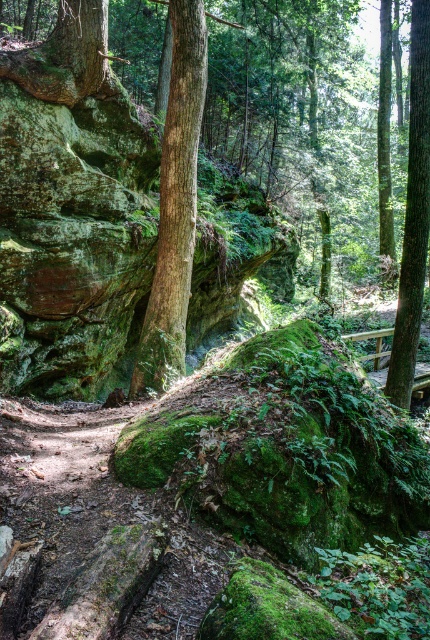
Question: Which object appears farthest from the camera in this image?

Choices:
 (A) green mossy rock at center
 (B) green rough bark tree at right
 (C) green rough bark tree at center

Answer: (B)

Question: Considering the relative positions of green rough bark tree at center and green rough bark tree at right in the image provided, where is green rough bark tree at center located with respect to green rough bark tree at right?

Choices:
 (A) left
 (B) right

Answer: (A)

Question: Is green mossy rock at center bigger than green rough bark tree at right?

Choices:
 (A) yes
 (B) no

Answer: (A)

Question: Which object is positioned farthest from the green mossy rock at center?

Choices:
 (A) green rough bark tree at center
 (B) green rough bark tree at right

Answer: (A)

Question: Based on their relative distances, which object is nearer to the green rough bark tree at center?

Choices:
 (A) green mossy rock at center
 (B) green rough bark tree at right

Answer: (B)

Question: From the image, what is the correct spatial relationship of green mossy rock at center in relation to green rough bark tree at center?

Choices:
 (A) above
 (B) below

Answer: (A)